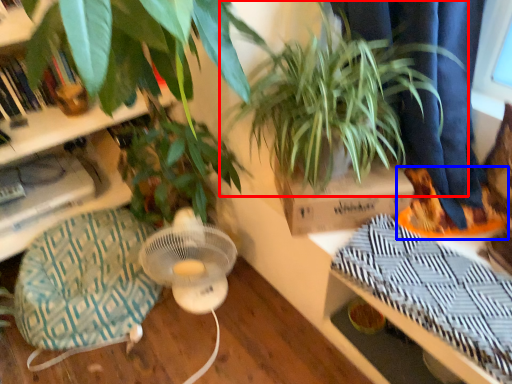
Question: Among these objects, which one is farthest to the camera, houseplant (highlighted by a red box) or shoe (highlighted by a blue box)?

Choices:
 (A) houseplant
 (B) shoe

Answer: (B)